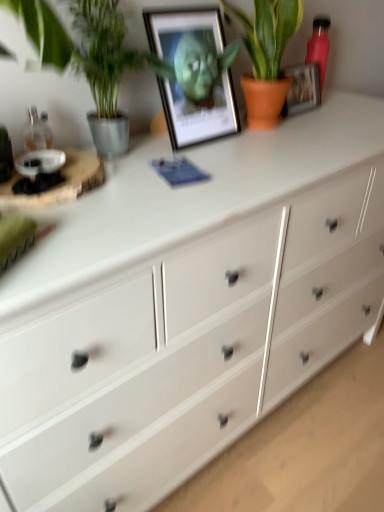
What do you see at coordinates (86, 45) in the screenshot? I see `green leafy plant at left, which is counted as the first houseplant, starting from the left` at bounding box center [86, 45].

From the picture: How much space does green leafy plant at left, which is the second houseplant in right-to-left order, occupy horizontally?

7.95 inches.

The image size is (384, 512). What are the coordinates of `pink matte bottle at upper right` in the screenshot? It's located at click(319, 46).

From the pink matte bottle at upper right, count 1st houseplants forward and point to it. Please provide its 2D coordinates.

[(266, 56)]

Is pink matte bottle at upper right positioned beyond the bounds of terracotta pot plant at upper center, the 2th houseplant when ordered from left to right?

Yes, pink matte bottle at upper right is outside of terracotta pot plant at upper center, the 2th houseplant when ordered from left to right.

How many degrees apart are the facing directions of pink matte bottle at upper right and terracotta pot plant at upper center, which is counted as the 1th houseplant, starting from the right?

The angular difference between pink matte bottle at upper right and terracotta pot plant at upper center, which is counted as the 1th houseplant, starting from the right, is 1.51 degrees.

Is pink matte bottle at upper right bigger or smaller than terracotta pot plant at upper center, the 2th houseplant when ordered from left to right?

Considering their sizes, pink matte bottle at upper right takes up less space than terracotta pot plant at upper center, the 2th houseplant when ordered from left to right.

Is metallic framed picture at upper center looking in the opposite direction of terracotta pot plant at upper center, which is counted as the 1th houseplant, starting from the right?

metallic framed picture at upper center is not turned away from terracotta pot plant at upper center, which is counted as the 1th houseplant, starting from the right.

Would you say metallic framed picture at upper center contains terracotta pot plant at upper center, the 2th houseplant when ordered from left to right?

Actually, terracotta pot plant at upper center, the 2th houseplant when ordered from left to right, is outside metallic framed picture at upper center.

Is metallic framed picture at upper center not close to terracotta pot plant at upper center, which is counted as the 1th houseplant, starting from the right?

No.

From a real-world perspective, starting from the metallic framed picture at upper center, which houseplant is the 2nd one vertically above it? Please provide its 2D coordinates.

[(266, 56)]

Considering the relative sizes of terracotta pot plant at upper center, which is counted as the 1th houseplant, starting from the right, and green leafy plant at left, which is counted as the first houseplant, starting from the left, in the image provided, is terracotta pot plant at upper center, which is counted as the 1th houseplant, starting from the right, shorter than green leafy plant at left, which is counted as the first houseplant, starting from the left,?

Correct, terracotta pot plant at upper center, which is counted as the 1th houseplant, starting from the right, is not as tall as green leafy plant at left, which is counted as the first houseplant, starting from the left.

Can you confirm if terracotta pot plant at upper center, the 2th houseplant when ordered from left to right, is wider than green leafy plant at left, which is the second houseplant in right-to-left order?

Yes.

Do you think terracotta pot plant at upper center, the 2th houseplant when ordered from left to right, is within green leafy plant at left, which is the second houseplant in right-to-left order, or outside of it?

terracotta pot plant at upper center, the 2th houseplant when ordered from left to right, exists outside the volume of green leafy plant at left, which is the second houseplant in right-to-left order.

From a real-world perspective, is pink matte bottle at upper right over green leafy plant at left, which is counted as the first houseplant, starting from the left?

No.

Does pink matte bottle at upper right appear on the right side of green leafy plant at left, which is counted as the first houseplant, starting from the left?

Yes, pink matte bottle at upper right is to the right of green leafy plant at left, which is counted as the first houseplant, starting from the left.

Is point (317, 46) closer to viewer compared to point (113, 15)?

No, it is behind (113, 15).

How distant is pink matte bottle at upper right from green leafy plant at left, which is counted as the first houseplant, starting from the left?

pink matte bottle at upper right is 28.23 inches from green leafy plant at left, which is counted as the first houseplant, starting from the left.

How many degrees apart are the facing directions of green leafy plant at left, which is counted as the first houseplant, starting from the left, and metallic framed picture at upper center?

The angle between the facing direction of green leafy plant at left, which is counted as the first houseplant, starting from the left, and the facing direction of metallic framed picture at upper center is 0.000528 degrees.

Which of these two, green leafy plant at left, which is counted as the first houseplant, starting from the left, or metallic framed picture at upper center, is thinner?

metallic framed picture at upper center.

From the image's perspective, is green leafy plant at left, which is counted as the first houseplant, starting from the left, over metallic framed picture at upper center?

Actually, green leafy plant at left, which is counted as the first houseplant, starting from the left, appears below metallic framed picture at upper center in the image.

This screenshot has height=512, width=384. I want to click on picture frame to the right of green leafy plant at left, which is counted as the first houseplant, starting from the left, so click(x=193, y=74).

Which is correct: green leafy plant at left, which is counted as the first houseplant, starting from the left, is inside terracotta pot plant at upper center, which is counted as the 1th houseplant, starting from the right, or outside of it?

green leafy plant at left, which is counted as the first houseplant, starting from the left, exists outside the volume of terracotta pot plant at upper center, which is counted as the 1th houseplant, starting from the right.

In the image, is green leafy plant at left, which is the second houseplant in right-to-left order, positioned in front of or behind terracotta pot plant at upper center, which is counted as the 1th houseplant, starting from the right?

Visually, green leafy plant at left, which is the second houseplant in right-to-left order, is located in front of terracotta pot plant at upper center, which is counted as the 1th houseplant, starting from the right.

Based on their sizes in the image, would you say green leafy plant at left, which is the second houseplant in right-to-left order, is bigger or smaller than terracotta pot plant at upper center, which is counted as the 1th houseplant, starting from the right?

Clearly, green leafy plant at left, which is the second houseplant in right-to-left order, is smaller in size than terracotta pot plant at upper center, which is counted as the 1th houseplant, starting from the right.

From the image's perspective, which one is positioned higher, green leafy plant at left, which is counted as the first houseplant, starting from the left, or terracotta pot plant at upper center, the 2th houseplant when ordered from left to right?

terracotta pot plant at upper center, the 2th houseplant when ordered from left to right, appears higher in the image.

Based on the photo, from a real-world perspective, is metallic framed picture at upper center located higher than pink matte bottle at upper right?

Indeed, from a real-world perspective, metallic framed picture at upper center stands above pink matte bottle at upper right.

Is metallic framed picture at upper center looking in the opposite direction of pink matte bottle at upper right?

No, metallic framed picture at upper center is not facing away from pink matte bottle at upper right.

Considering the relative sizes of metallic framed picture at upper center and pink matte bottle at upper right in the image provided, is metallic framed picture at upper center thinner than pink matte bottle at upper right?

Incorrect, the width of metallic framed picture at upper center is not less than that of pink matte bottle at upper right.

Who is shorter, metallic framed picture at upper center or pink matte bottle at upper right?

pink matte bottle at upper right is shorter.

This screenshot has width=384, height=512. Identify the location of the 1st houseplant to the left of the pink matte bottle at upper right, counting from the anchor's position. (266, 56).

From a real-world perspective, count 2nd houseplants upward from the metallic framed picture at upper center and point to it. Please provide its 2D coordinates.

[(266, 56)]

Based on their spatial positions, is metallic framed picture at upper center or pink matte bottle at upper right further from green leafy plant at left, which is the second houseplant in right-to-left order?

The object further to green leafy plant at left, which is the second houseplant in right-to-left order, is pink matte bottle at upper right.

Based on their spatial positions, is green leafy plant at left, which is the second houseplant in right-to-left order, or pink matte bottle at upper right closer to terracotta pot plant at upper center, the 2th houseplant when ordered from left to right?

pink matte bottle at upper right is closer to terracotta pot plant at upper center, the 2th houseplant when ordered from left to right.

Looking at the image, which one is located further to metallic framed picture at upper center, pink matte bottle at upper right or terracotta pot plant at upper center, which is counted as the 1th houseplant, starting from the right?

pink matte bottle at upper right is positioned further to the anchor metallic framed picture at upper center.

Looking at the image, which one is located closer to green leafy plant at left, which is the second houseplant in right-to-left order, terracotta pot plant at upper center, the 2th houseplant when ordered from left to right, or metallic framed picture at upper center?

metallic framed picture at upper center is closer to green leafy plant at left, which is the second houseplant in right-to-left order.

Based on their spatial positions, is green leafy plant at left, which is counted as the first houseplant, starting from the left, or terracotta pot plant at upper center, which is counted as the 1th houseplant, starting from the right, closer to pink matte bottle at upper right?

Among the two, terracotta pot plant at upper center, which is counted as the 1th houseplant, starting from the right, is located nearer to pink matte bottle at upper right.

Which object lies nearer to the anchor point pink matte bottle at upper right, metallic framed picture at upper center or terracotta pot plant at upper center, the 2th houseplant when ordered from left to right?

The object closer to pink matte bottle at upper right is terracotta pot plant at upper center, the 2th houseplant when ordered from left to right.

Looking at the image, which one is located closer to terracotta pot plant at upper center, the 2th houseplant when ordered from left to right, green leafy plant at left, which is counted as the first houseplant, starting from the left, or metallic framed picture at upper center?

metallic framed picture at upper center.

From the image, which object appears to be nearer to pink matte bottle at upper right, green leafy plant at left, which is counted as the first houseplant, starting from the left, or metallic framed picture at upper center?

metallic framed picture at upper center is positioned closer to the anchor pink matte bottle at upper right.

Locate an element on the screen. picture frame situated between green leafy plant at left, which is the second houseplant in right-to-left order, and pink matte bottle at upper right from left to right is located at coordinates (193, 74).

Where is `houseplant between green leafy plant at left, which is the second houseplant in right-to-left order, and pink matte bottle at upper right, in the horizontal direction`? houseplant between green leafy plant at left, which is the second houseplant in right-to-left order, and pink matte bottle at upper right, in the horizontal direction is located at coordinates (266, 56).

Identify the location of houseplant located between metallic framed picture at upper center and pink matte bottle at upper right in the depth direction. (266, 56).

This screenshot has height=512, width=384. In order to click on picture frame between green leafy plant at left, which is counted as the first houseplant, starting from the left, and terracotta pot plant at upper center, which is counted as the 1th houseplant, starting from the right, from left to right in this screenshot , I will do `click(193, 74)`.